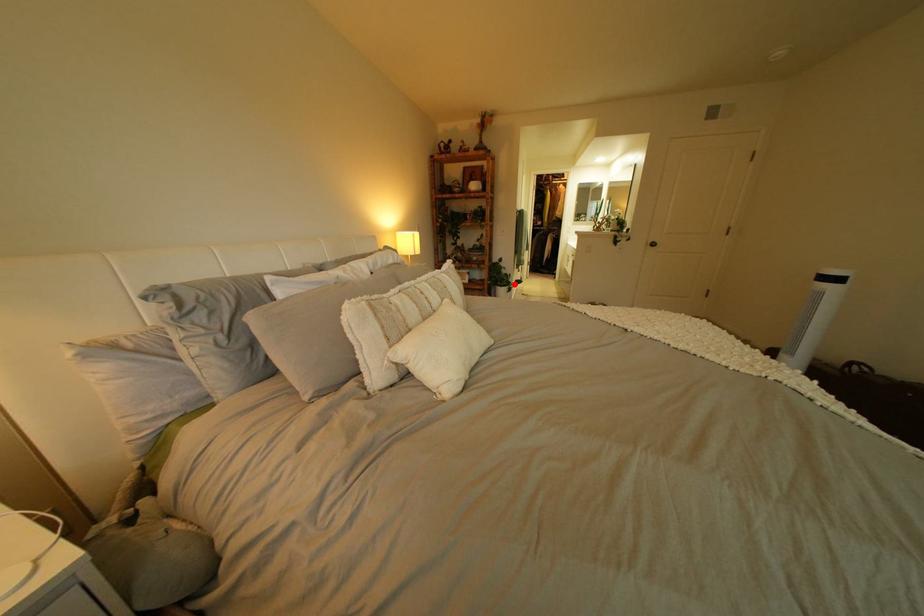
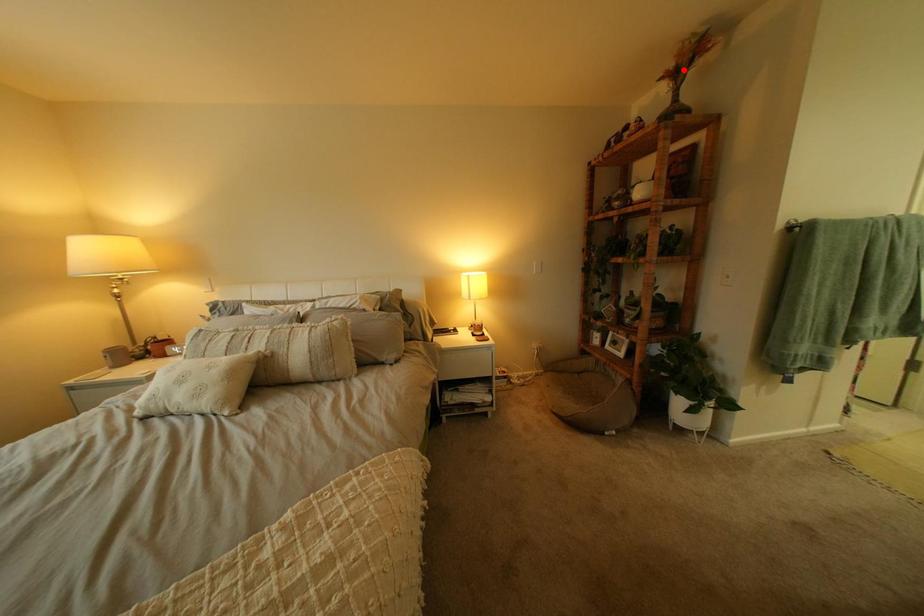
I am providing you with two images of the same scene from different viewpoints. A red point is marked on the first image and another point is marked on the second image. Are the points marked in image1 and image2 representing the same 3D position?

No